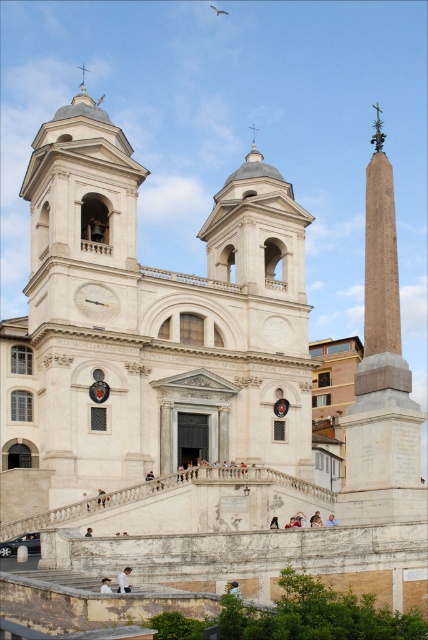
You are a visitor standing in front of the cathedral. You see the smooth stone obelisk at right and the blue denim jeans at lower center. Which object is positioned higher from the ground?

The smooth stone obelisk at right is located above the blue denim jeans at lower center, so it is positioned higher from the ground.

You are standing at the entrance of the grand architectural structure. You need to locate the white fabric person at lower center. According to the coordinates provided, where exactly should you look to find them?

The white fabric person at lower center is located at the coordinates point (124, 580). This means they are positioned near the bottom right corner of the image, slightly to the left of the central axis. Since the coordinates are normalized between 0 and (388, 639) on the x axis places them close to the right edge, and 0.290 on the y axis places them towards the lower part of the image.